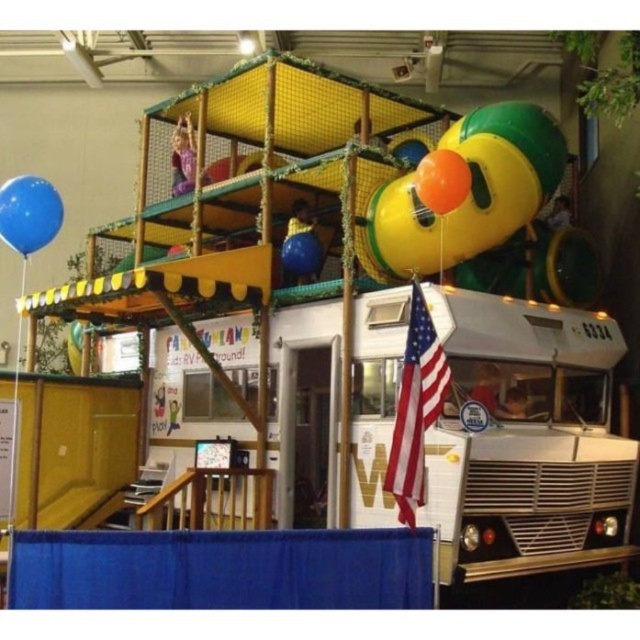
Does blue rubber balloon at left appear on the right side of orange rubber balloon at upper center?

No, blue rubber balloon at left is not to the right of orange rubber balloon at upper center.

Which is more to the left, blue rubber balloon at left or orange rubber balloon at upper center?

blue rubber balloon at left

Between point (26, 179) and point (426, 172), which one is positioned in front?

Point (426, 172) is in front.

At what (x,y) coordinates should I click in order to perform the action: click on blue rubber balloon at left. Please return your answer as a coordinate pair (x, y). The height and width of the screenshot is (640, 640). Looking at the image, I should click on (28, 212).

Can you confirm if rubber duck balloon at upper right is bigger than blue rubber balloon at center?

Yes.

Does point (560, 134) come in front of point (320, 248)?

Yes, point (560, 134) is closer to viewer.

Locate an element on the screen. The height and width of the screenshot is (640, 640). rubber duck balloon at upper right is located at coordinates (470, 192).

Is point (419, 483) behind point (20, 189)?

No, it is in front of (20, 189).

What do you see at coordinates (416, 408) in the screenshot? This screenshot has width=640, height=640. I see `american flag at center` at bounding box center [416, 408].

Locate an element on the screen. Image resolution: width=640 pixels, height=640 pixels. american flag at center is located at coordinates (416, 408).